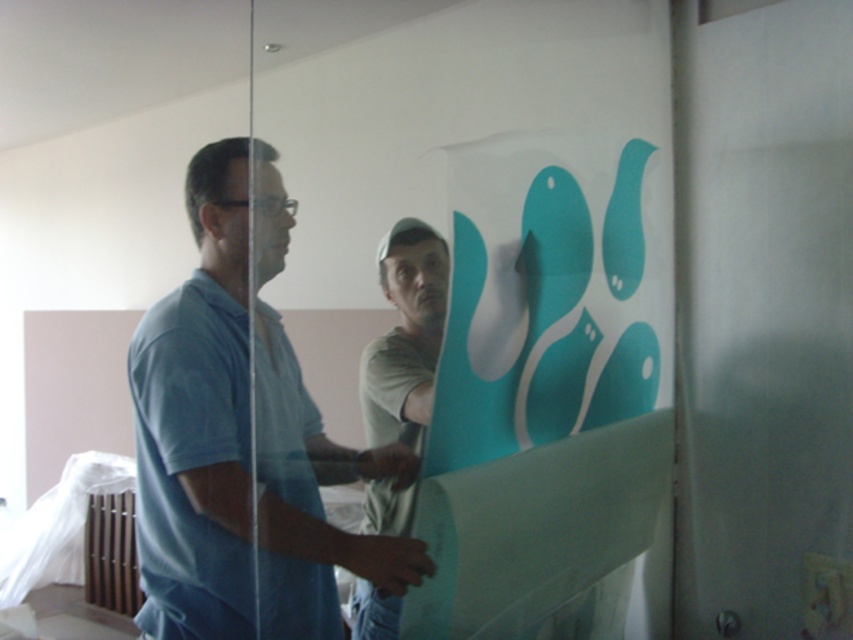
Question: In this image, where is transparent plastic glass door at center located relative to light brown paper at center?

Choices:
 (A) left
 (B) right

Answer: (A)

Question: Which of the following is the farthest from the observer?

Choices:
 (A) light brown paper at center
 (B) transparent plastic glass door at center

Answer: (A)

Question: Estimate the real-world distances between objects in this image. Which object is farther from the blue cotton shirt at left?

Choices:
 (A) transparent plastic glass door at center
 (B) light brown paper at center

Answer: (A)

Question: Considering the relative positions of blue cotton shirt at left and light brown paper at center in the image provided, where is blue cotton shirt at left located with respect to light brown paper at center?

Choices:
 (A) right
 (B) left

Answer: (B)

Question: Which point is closer to the camera?

Choices:
 (A) transparent plastic glass door at center
 (B) light brown paper at center
 (C) blue cotton shirt at left

Answer: (A)

Question: Does blue cotton shirt at left have a smaller size compared to light brown paper at center?

Choices:
 (A) no
 (B) yes

Answer: (A)